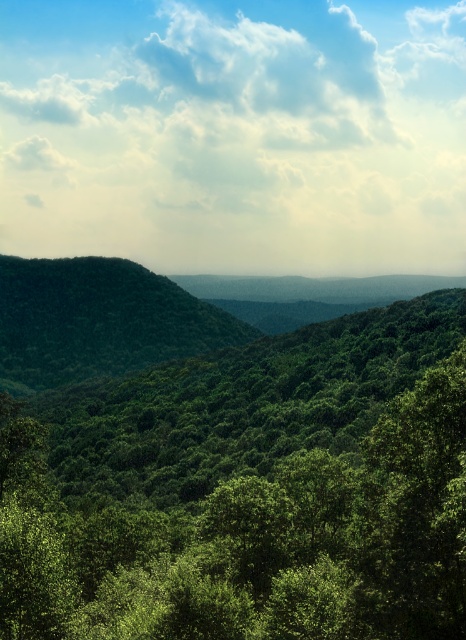
Question: Is green leafy tree at center bigger than green leafy hill at center?

Choices:
 (A) yes
 (B) no

Answer: (A)

Question: Is green leafy tree at center below green leafy hill at center?

Choices:
 (A) yes
 (B) no

Answer: (A)

Question: In this image, where is green leafy tree at center located relative to green leafy hill at center?

Choices:
 (A) left
 (B) right

Answer: (B)

Question: Among these objects, which one is farthest from the camera?

Choices:
 (A) green leafy tree at center
 (B) green leafy hill at center

Answer: (B)